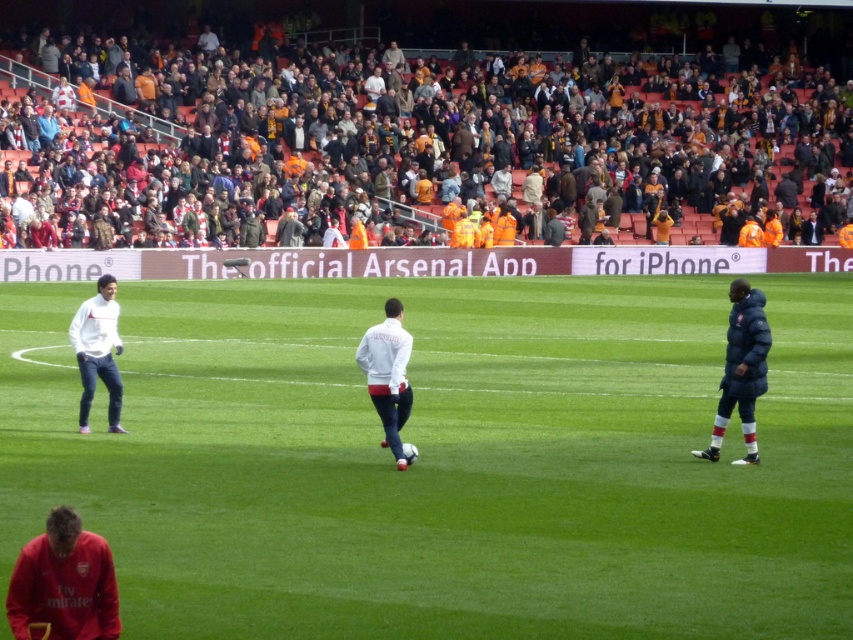
Is the position of green grass at center more distant than that of brown leather seats at upper center?

No, green grass at center is in front of brown leather seats at upper center.

Looking at this image, does green grass at center have a smaller size compared to brown leather seats at upper center?

Yes, green grass at center is smaller than brown leather seats at upper center.

The width and height of the screenshot is (853, 640). I want to click on green grass at center, so click(444, 460).

Is brown leather seats at upper center smaller than white matte jacket at left?

No.

Which of these two, brown leather seats at upper center or white matte jacket at left, stands shorter?

white matte jacket at left

Which is in front, point (531, 90) or point (73, 344)?

Point (73, 344)

You are a GUI agent. You are given a task and a screenshot of the screen. Output one action in this format:
    pyautogui.click(x=<x>, y=<y>)
    Task: Click on the brown leather seats at upper center
    This screenshot has height=640, width=853.
    Given the screenshot: What is the action you would take?
    pyautogui.click(x=421, y=134)

At what (x,y) coordinates should I click in order to perform the action: click on green grass at center. Please return your answer as a coordinate pair (x, y). This screenshot has width=853, height=640. Looking at the image, I should click on (444, 460).

Can you confirm if green grass at center is positioned to the right of white matte jacket at left?

Correct, you'll find green grass at center to the right of white matte jacket at left.

Which is in front, point (335, 321) or point (96, 332)?

Point (96, 332) is in front.

Locate an element on the screen. green grass at center is located at coordinates [x=444, y=460].